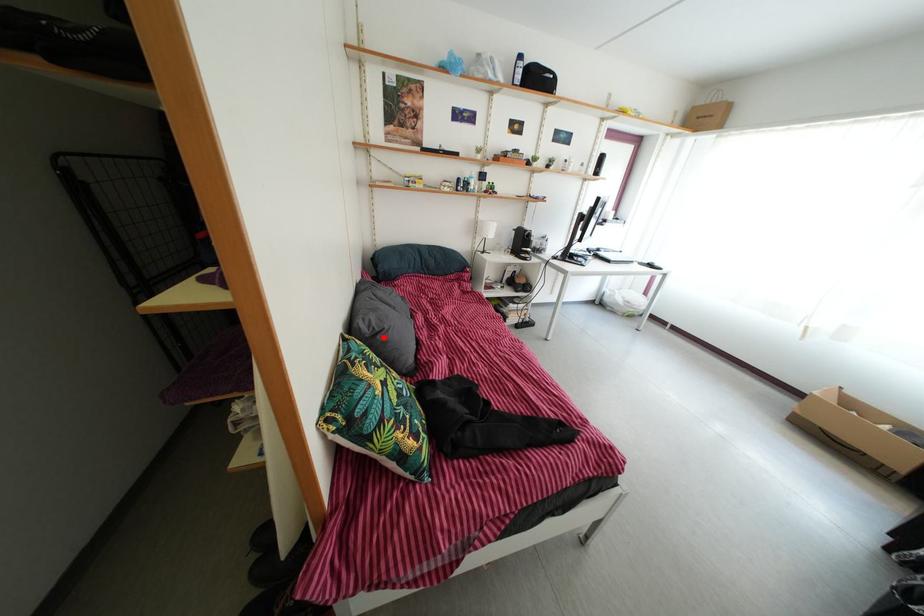
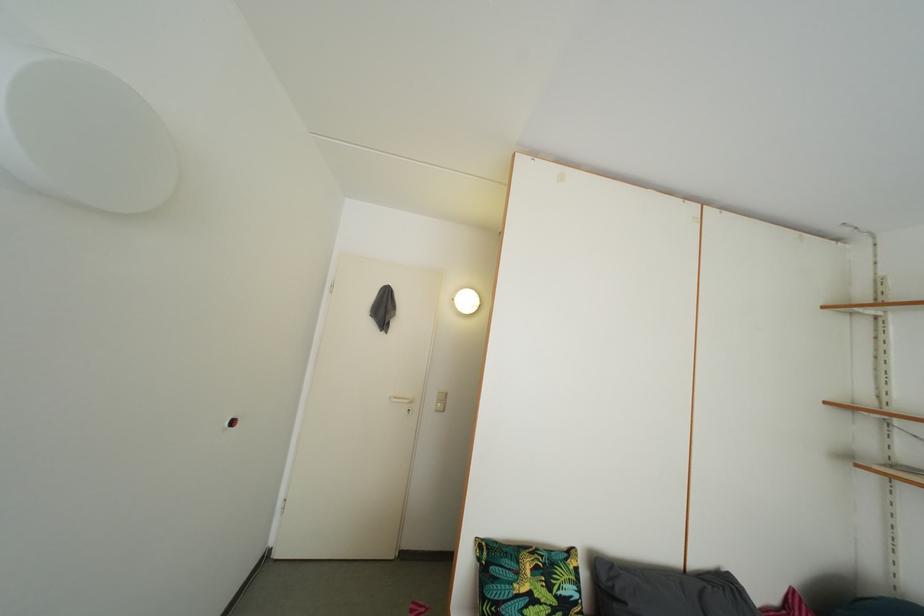
Question: I am providing you with two images of the same scene from different viewpoints. A red point is shown in image1. For the corresponding object point in image2, is it positioned nearer or farther from the camera?

Choices:
 (A) Nearer
 (B) Farther

Answer: (B)